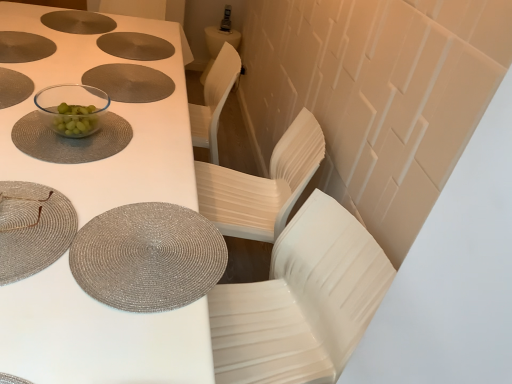
The width and height of the screenshot is (512, 384). I want to click on space that is in front of silver textured placemat at lower left, which ranks as the 1th tableware in bottom-to-top order, so click(110, 332).